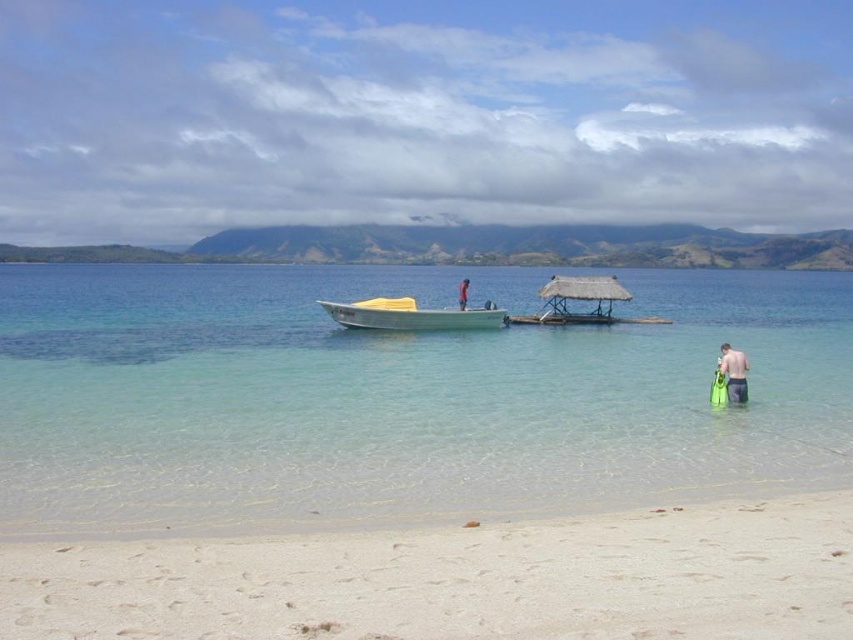
Question: Which object is closer to the camera taking this photo?

Choices:
 (A) skinny man at lower right
 (B) skinny man at center

Answer: (A)

Question: Is white sandy beach at lower center bigger than skinny man at center?

Choices:
 (A) no
 (B) yes

Answer: (A)

Question: Which object is the closest to the clear water at beach center?

Choices:
 (A) white sandy beach at lower center
 (B) white glossy boat at center
 (C) skinny man at lower right

Answer: (B)

Question: Is clear water at beach center positioned in front of skinny man at lower right?

Choices:
 (A) no
 (B) yes

Answer: (B)

Question: Estimate the real-world distances between objects in this image. Which object is farther from the clear water at beach center?

Choices:
 (A) skinny man at lower right
 (B) white sandy beach at lower center

Answer: (B)

Question: In this image, where is clear water at beach center located relative to white sandy beach at lower center?

Choices:
 (A) above
 (B) below

Answer: (A)